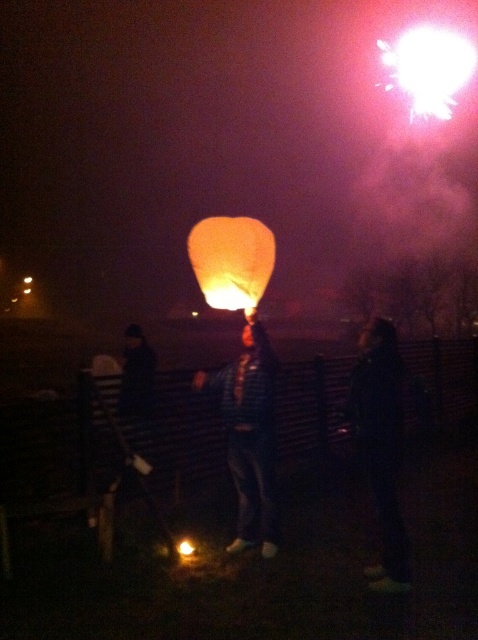
Question: Considering the real-world distances, which object is farthest from the dark blue fabric pants at right?

Choices:
 (A) matte orange paper lantern at center
 (B) bright white light at upper right

Answer: (B)

Question: Where is striped fabric pants at center located in relation to bright white light at upper right in the image?

Choices:
 (A) above
 (B) below

Answer: (B)

Question: Which object is the closest to the striped fabric pants at center?

Choices:
 (A) bright white light at upper right
 (B) dark blue fabric pants at right
 (C) matte orange paper lantern at center

Answer: (B)

Question: Is striped fabric pants at center thinner than bright white light at upper right?

Choices:
 (A) no
 (B) yes

Answer: (B)

Question: Which point appears farthest from the camera in this image?

Choices:
 (A) click(228, 552)
 (B) click(404, 58)
 (C) click(388, 444)

Answer: (B)

Question: In this image, where is striped fabric pants at center located relative to bright white light at upper right?

Choices:
 (A) left
 (B) right

Answer: (A)